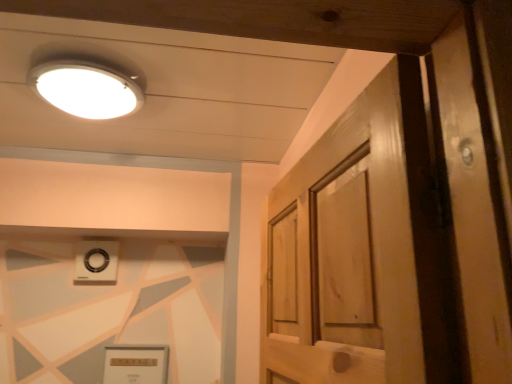
Question: Is white glossy light fixture at upper left touching matte gold picture frame at lower center?

Choices:
 (A) no
 (B) yes

Answer: (A)

Question: Is white glossy light fixture at upper left not close to matte gold picture frame at lower center?

Choices:
 (A) yes
 (B) no

Answer: (A)

Question: Is white glossy light fixture at upper left taller than matte gold picture frame at lower center?

Choices:
 (A) yes
 (B) no

Answer: (B)

Question: Is white glossy light fixture at upper left oriented away from matte gold picture frame at lower center?

Choices:
 (A) no
 (B) yes

Answer: (A)

Question: From the image's perspective, is white glossy light fixture at upper left on matte gold picture frame at lower center?

Choices:
 (A) yes
 (B) no

Answer: (A)

Question: From a real-world perspective, is white glossy light fixture at upper left positioned above or below matte gold picture frame at lower center?

Choices:
 (A) above
 (B) below

Answer: (A)

Question: Would you say white glossy light fixture at upper left is to the left or to the right of matte gold picture frame at lower center in the picture?

Choices:
 (A) right
 (B) left

Answer: (A)

Question: Is white glossy light fixture at upper left taller or shorter than matte gold picture frame at lower center?

Choices:
 (A) tall
 (B) short

Answer: (B)

Question: Is point (141, 96) positioned closer to the camera than point (125, 360)?

Choices:
 (A) closer
 (B) farther

Answer: (A)

Question: In terms of height, does matte gold picture frame at lower center look taller or shorter compared to white glossy light fixture at upper left?

Choices:
 (A) tall
 (B) short

Answer: (A)

Question: Considering the positions of point (118, 354) and point (77, 112), is point (118, 354) closer or farther from the camera than point (77, 112)?

Choices:
 (A) farther
 (B) closer

Answer: (A)

Question: Looking at the image, does matte gold picture frame at lower center seem bigger or smaller compared to white glossy light fixture at upper left?

Choices:
 (A) big
 (B) small

Answer: (B)

Question: Would you say matte gold picture frame at lower center is inside or outside white glossy light fixture at upper left?

Choices:
 (A) inside
 (B) outside

Answer: (B)

Question: Is white plastic knob at upper center inside or outside of matte gold picture frame at lower center?

Choices:
 (A) outside
 (B) inside

Answer: (A)

Question: From the image's perspective, is white plastic knob at upper center above or below matte gold picture frame at lower center?

Choices:
 (A) above
 (B) below

Answer: (A)